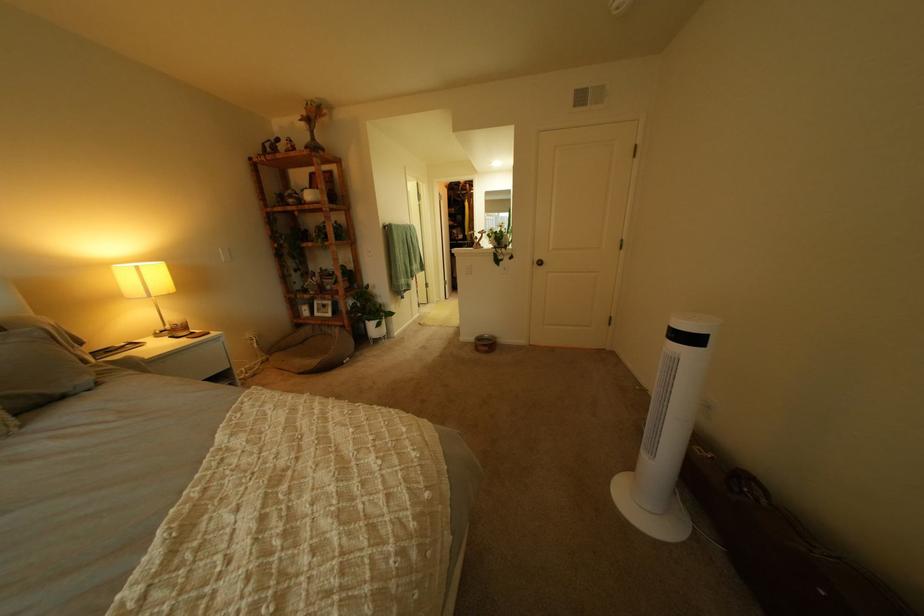
Where is `silver doorknob`? The height and width of the screenshot is (616, 924). silver doorknob is located at coordinates (539, 262).